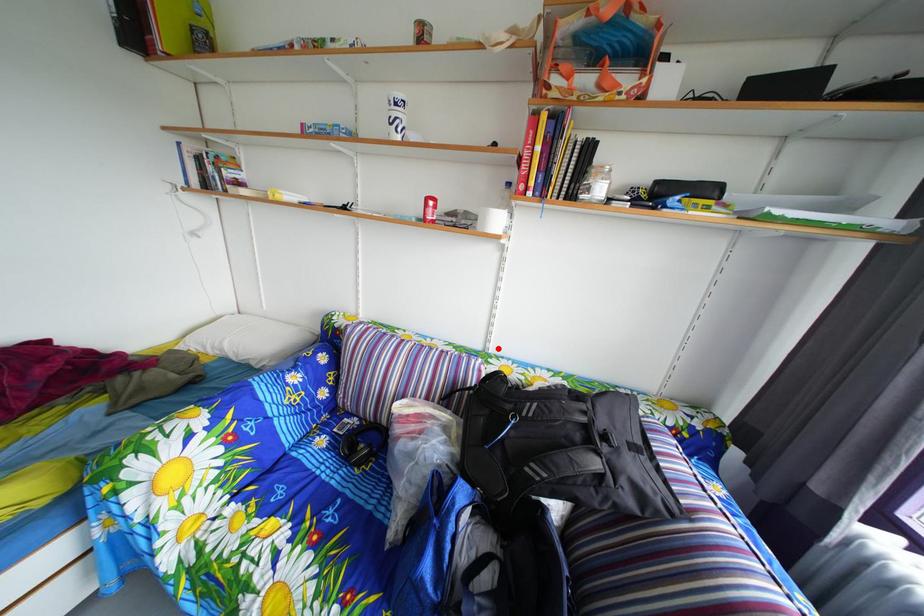
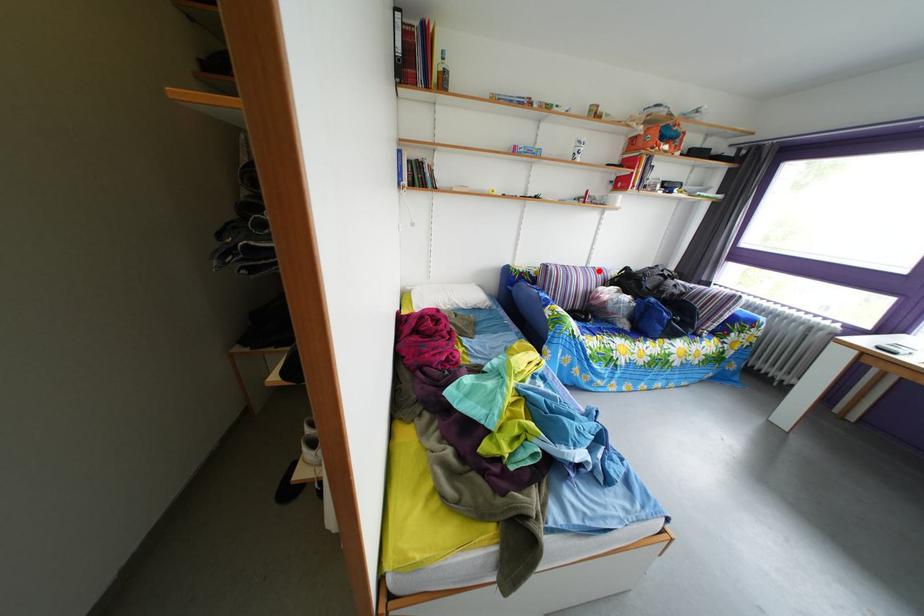
I am providing you with two images of the same scene from different viewpoints. A red point is marked on the first image and another point is marked on the second image. Are the points marked in image1 and image2 representing the same 3D position?

Yes